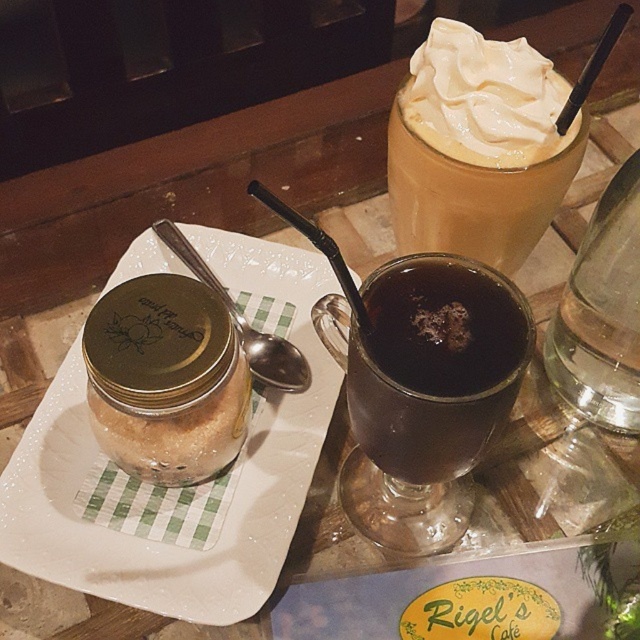
Question: Is whipped cream at upper right above translucent glass cup at upper right?

Choices:
 (A) yes
 (B) no

Answer: (A)

Question: Does matte gold jar at left appear under translucent glass cup at upper right?

Choices:
 (A) yes
 (B) no

Answer: (A)

Question: Which point is farther from the camera taking this photo?

Choices:
 (A) (481, 365)
 (B) (486, 404)
 (C) (516, 116)

Answer: (C)

Question: Which of the following is the farthest from the observer?

Choices:
 (A) translucent glass cup at upper right
 (B) dark glass cup at center

Answer: (A)

Question: Is dark glass cup at center to the left of silver metallic spoon at upper left from the viewer's perspective?

Choices:
 (A) yes
 (B) no

Answer: (B)

Question: Which is farther from the whipped cream at upper right?

Choices:
 (A) matte gold jar at left
 (B) silver metallic spoon at upper left
 (C) translucent glass cup at upper right

Answer: (A)